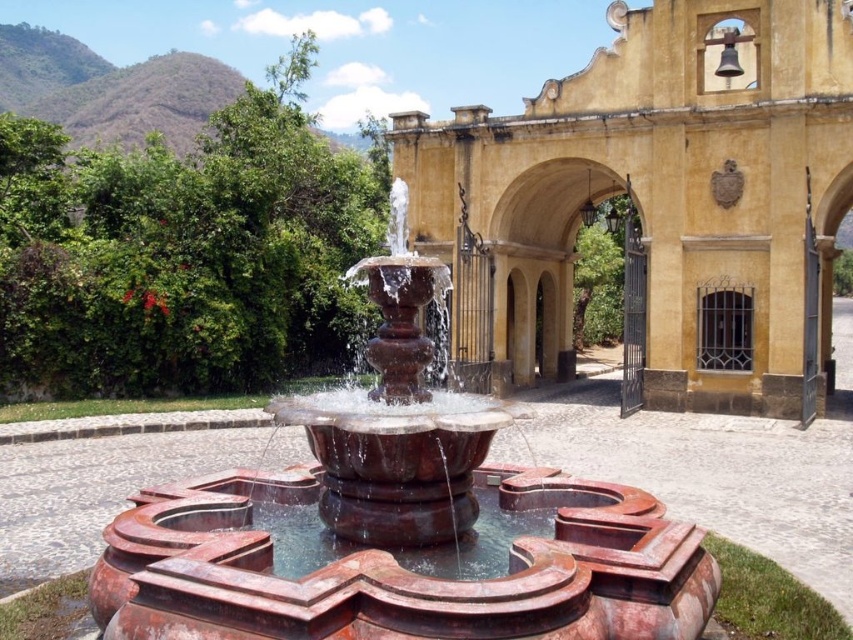
Question: Which object is farther from the camera taking this photo?

Choices:
 (A) rustic terracotta fountain at center
 (B) matte yellow stone church at center

Answer: (B)

Question: Can you confirm if matte yellow stone church at center is thinner than rustic terracotta fountain at center?

Choices:
 (A) yes
 (B) no

Answer: (B)

Question: Which point is closer to the camera?

Choices:
 (A) rustic terracotta fountain at center
 (B) matte yellow stone church at center

Answer: (A)

Question: Is the position of matte yellow stone church at center more distant than that of rustic terracotta fountain at center?

Choices:
 (A) no
 (B) yes

Answer: (B)

Question: Which of the following is the farthest from the observer?

Choices:
 (A) (289, 602)
 (B) (722, 323)

Answer: (B)

Question: Is matte yellow stone church at center to the right of rustic terracotta fountain at center from the viewer's perspective?

Choices:
 (A) no
 (B) yes

Answer: (B)